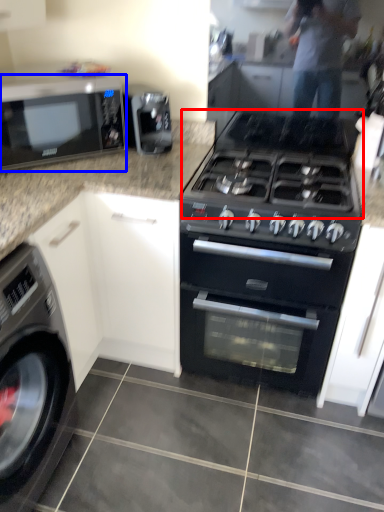
Question: Which point is further to the camera, gas stove (highlighted by a red box) or microwave oven (highlighted by a blue box)?

Choices:
 (A) gas stove
 (B) microwave oven

Answer: (B)